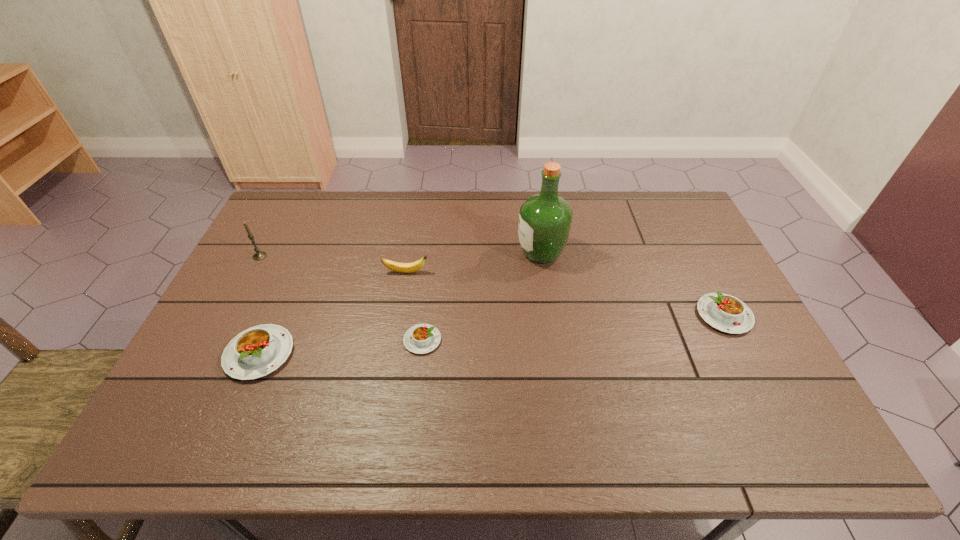
This screenshot has height=540, width=960. I want to click on free space located 0.080m on the back of the leftmost pudding, so click(280, 305).

Find the location of `vacant region located on the front of the shortest pudding`. vacant region located on the front of the shortest pudding is located at coordinates (416, 401).

This screenshot has height=540, width=960. Identify the location of free space located 0.280m on the back of the second shortest object. (683, 234).

At what (x,y) coordinates should I click in order to perform the action: click on free space located on the right of the fifth shortest object. Please return your answer as a coordinate pair (x, y). Looking at the image, I should click on (285, 256).

Locate an element on the screen. Image resolution: width=960 pixels, height=540 pixels. vacant region located at the stem of the banana is located at coordinates (523, 272).

This screenshot has width=960, height=540. What are the coordinates of `vacant region located 0.200m on the front-facing side of the liquor` in the screenshot? It's located at (454, 253).

This screenshot has height=540, width=960. In order to click on blank space located on the front-facing side of the liquor in this screenshot , I will do `click(393, 253)`.

Image resolution: width=960 pixels, height=540 pixels. I want to click on vacant point located 0.300m on the front-facing side of the liquor, so click(423, 253).

At what (x,y) coordinates should I click in order to perform the action: click on object that is positioned at the near edge. Please return your answer as a coordinate pair (x, y). Looking at the image, I should click on (256, 352).

Locate an element on the screen. pudding that is at the left edge is located at coordinates (256, 352).